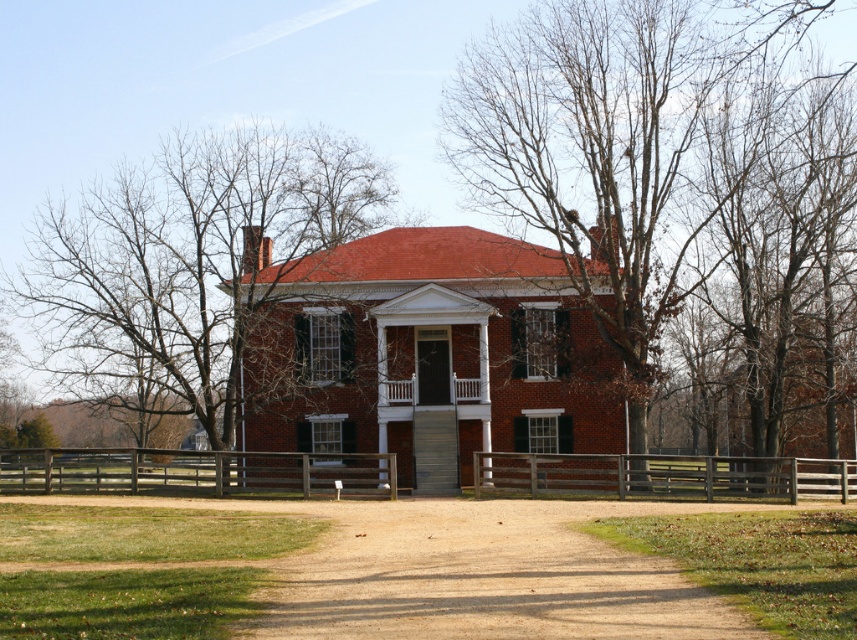
Which is more to the left, bare branches at upper center or brown wooden fence at center?

brown wooden fence at center

Which of these two, bare branches at upper center or brown wooden fence at center, stands shorter?

brown wooden fence at center

Does point (632, 51) come behind point (492, 470)?

Yes.

Identify the location of bare branches at upper center. (658, 177).

Is brown wooden fence at lower center above brown wooden fence at center?

Correct, brown wooden fence at lower center is located above brown wooden fence at center.

Can you confirm if brown wooden fence at lower center is shorter than brown wooden fence at center?

Correct, brown wooden fence at lower center is not as tall as brown wooden fence at center.

Locate an element on the screen. The width and height of the screenshot is (857, 640). brown wooden fence at lower center is located at coordinates (196, 472).

The width and height of the screenshot is (857, 640). Describe the element at coordinates (658, 177) in the screenshot. I see `bare branches at upper center` at that location.

Between bare branches at upper center and brown wooden fence at lower center, which one appears on the left side from the viewer's perspective?

Positioned to the left is brown wooden fence at lower center.

This screenshot has height=640, width=857. Describe the element at coordinates (658, 177) in the screenshot. I see `bare branches at upper center` at that location.

The height and width of the screenshot is (640, 857). Find the location of `bare branches at upper center`. bare branches at upper center is located at coordinates [658, 177].